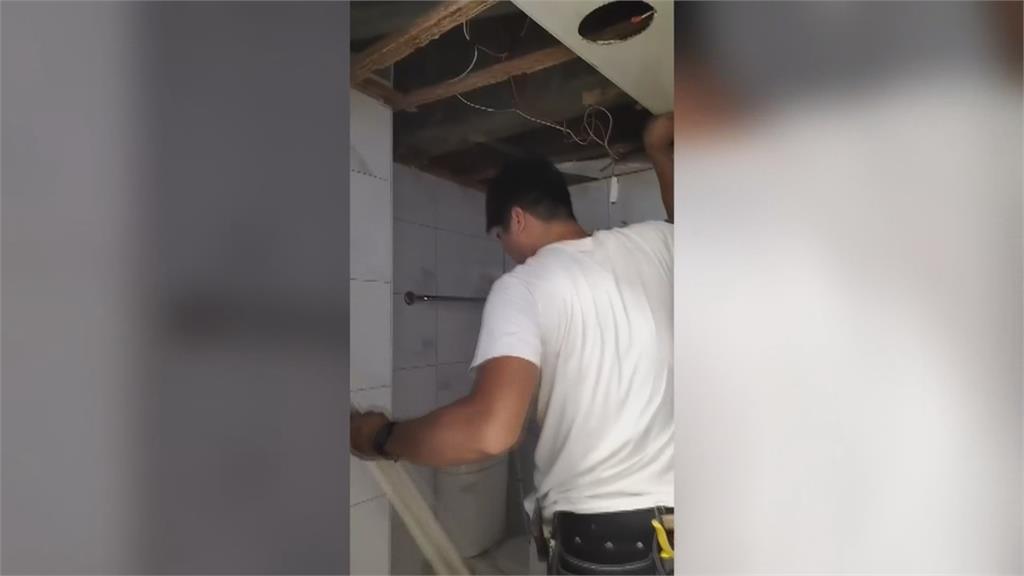
In order to click on support pillar in this screenshot , I will do `click(548, 98)`.